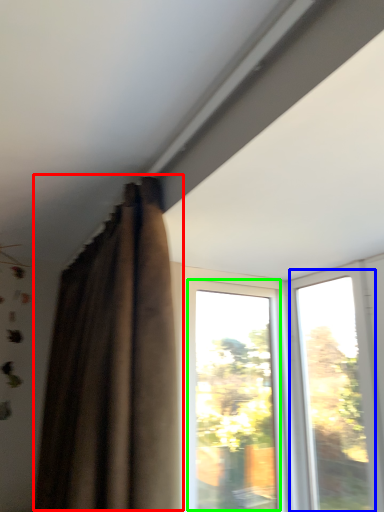
Question: Based on their relative distances, which object is nearer to curtain (highlighted by a red box)? Choose from window (highlighted by a blue box) and window (highlighted by a green box).

Choices:
 (A) window
 (B) window

Answer: (B)